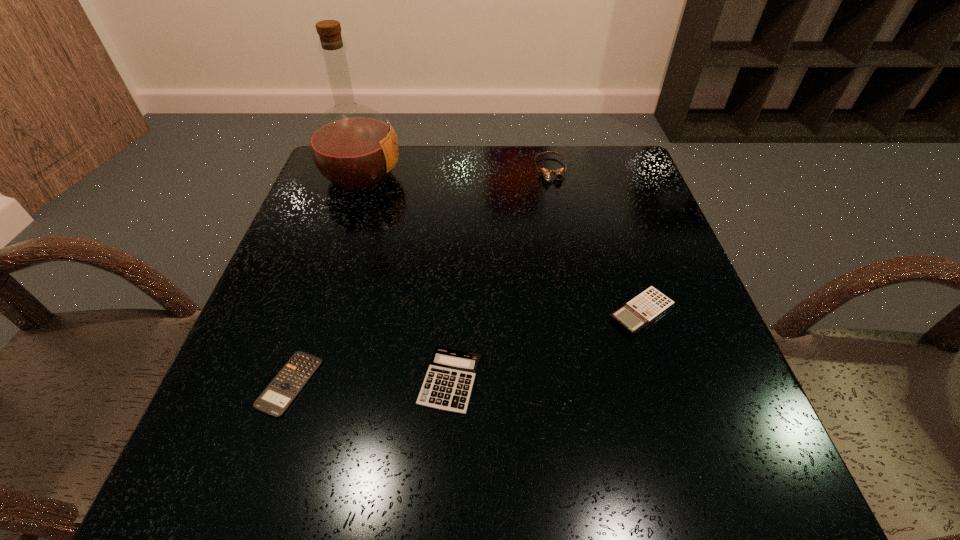
Where is `the tallest object`? The image size is (960, 540). the tallest object is located at coordinates (353, 146).

You are a GUI agent. You are given a task and a screenshot of the screen. Output one action in this format:
    pyautogui.click(x=<x>, y=<y>)
    Task: Click on the fourth object from left to right
    This screenshot has width=960, height=540.
    Given the screenshot: What is the action you would take?
    pyautogui.click(x=546, y=173)

I want to click on the second tallest object, so click(546, 173).

Find the location of `the third object from right to left`. the third object from right to left is located at coordinates (448, 383).

At what (x,y) coordinates should I click in order to perform the action: click on the rightmost object. Please return your answer as a coordinate pair (x, y). This screenshot has width=960, height=540. Looking at the image, I should click on (647, 306).

Identify the location of the third nearest object. (647, 306).

Locate an element on the screen. Image resolution: width=960 pixels, height=540 pixels. the leftmost calculator is located at coordinates (280, 393).

Find the location of a particular element. The width and height of the screenshot is (960, 540). the shortest calculator is located at coordinates (280, 393).

I want to click on vacant space located on the front label of the liquor, so click(547, 176).

This screenshot has height=540, width=960. In order to click on vacant area situated 0.340m on the front lenses and sides of the second object from right to left in this screenshot , I will do `click(573, 281)`.